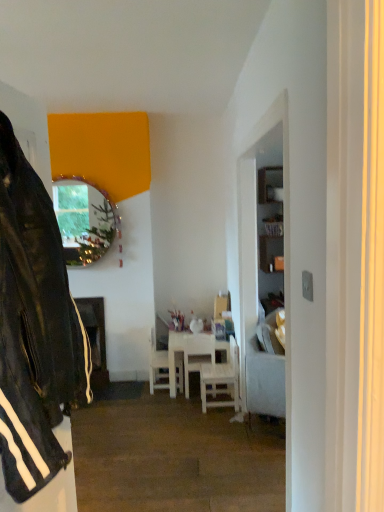
You are a GUI agent. You are given a task and a screenshot of the screen. Output one action in this format:
    pyautogui.click(x=<x>, y=<y>)
    Task: Click on the free space that is to the left of white wood chair at center, which is the 3th chair from right to left
    This screenshot has height=512, width=384.
    Given the screenshot: What is the action you would take?
    pyautogui.click(x=128, y=387)